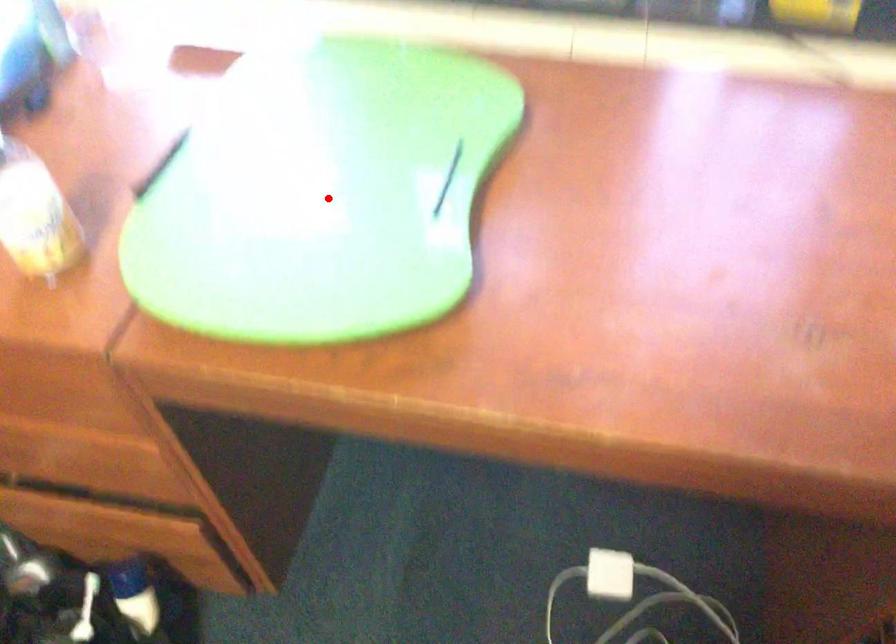
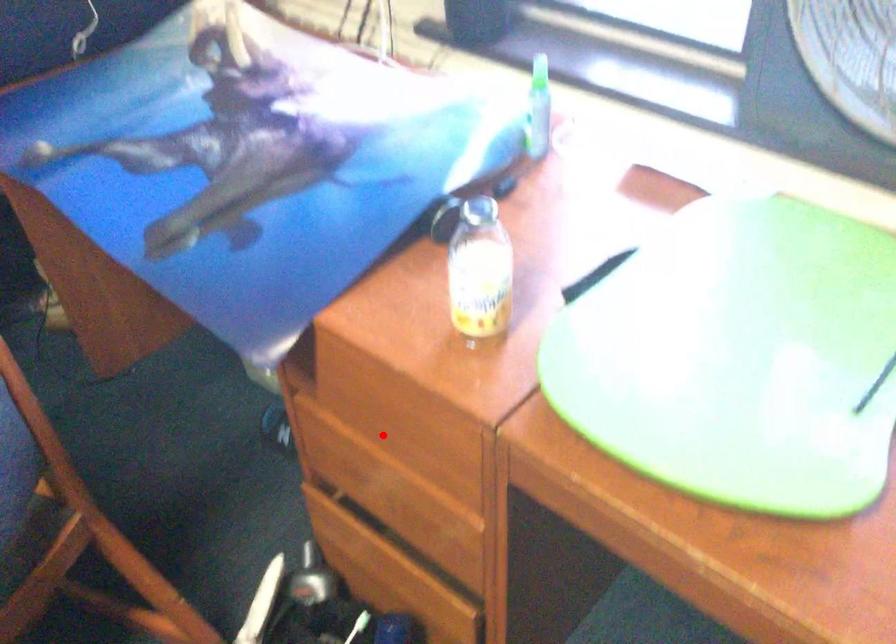
I am providing you with two images of the same scene from different viewpoints. A red point is marked on the first image and another point is marked on the second image. Is the red point in image1 aligned with the point shown in image2?

No